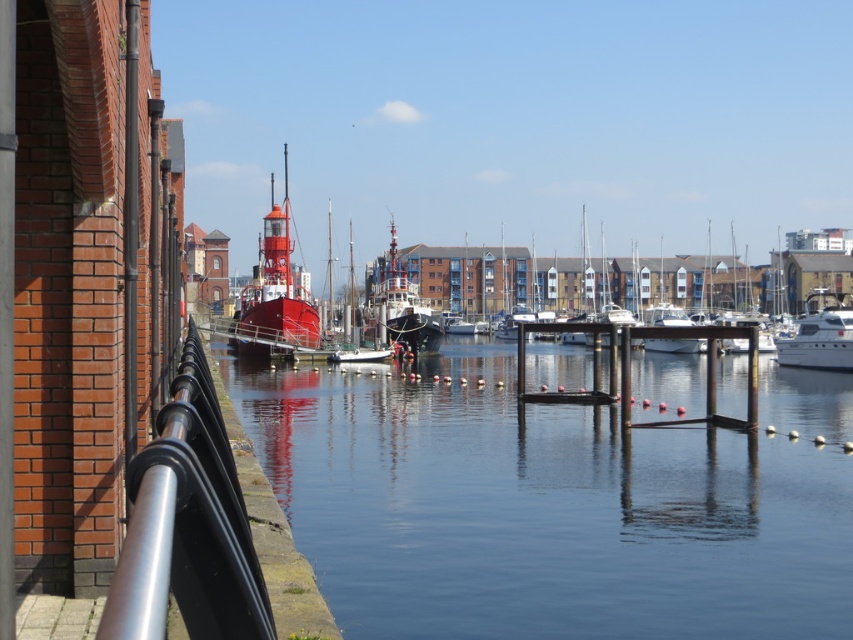
Question: Which point appears closest to the camera in this image?

Choices:
 (A) click(381, 316)
 (B) click(270, 296)

Answer: (B)

Question: Which object is farther from the camera taking this photo?

Choices:
 (A) silver metallic railing at lower left
 (B) shiny red boat at center
 (C) white glossy boat at right
 (D) shiny black boat at center

Answer: (D)

Question: Does transparent water at center come behind silver metallic railing at lower left?

Choices:
 (A) no
 (B) yes

Answer: (B)

Question: Is transparent water at center wider than white glossy boat at right?

Choices:
 (A) yes
 (B) no

Answer: (A)

Question: Is transparent water at center to the right of shiny red boat at center from the viewer's perspective?

Choices:
 (A) no
 (B) yes

Answer: (B)

Question: Estimate the real-world distances between objects in this image. Which object is farther from the white glossy boat at right?

Choices:
 (A) shiny red boat at center
 (B) shiny black boat at center
 (C) transparent water at center
 (D) silver metallic railing at lower left

Answer: (D)